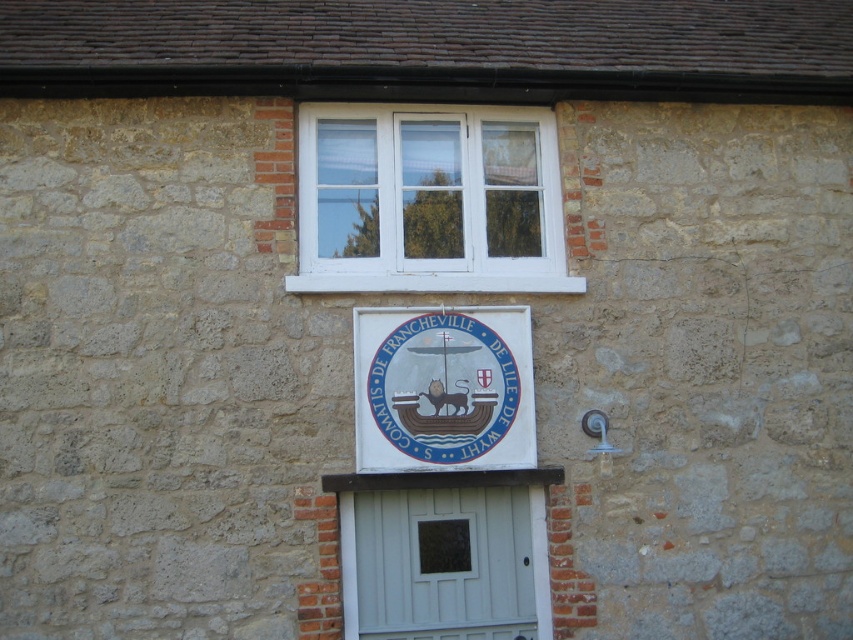
Is white plastic window at upper center taller than white painted wood door at center?

Yes.

Who is more distant from viewer, [457,163] or [387,589]?

The point [457,163] is behind.

Find the location of a particular element. white plastic window at upper center is located at coordinates (428, 200).

Can you confirm if white painted wood door at center is positioned below white glossy sign at center?

Indeed, white painted wood door at center is positioned under white glossy sign at center.

Can you confirm if white painted wood door at center is positioned to the left of white glossy sign at center?

No, white painted wood door at center is not to the left of white glossy sign at center.

Is point (431, 516) positioned in front of point (492, 424)?

No, it is not.

Identify the location of white painted wood door at center. (445, 563).

Who is positioned more to the left, white plastic window at upper center or white glossy sign at center?

white plastic window at upper center

Which is more to the right, white plastic window at upper center or white glossy sign at center?

white glossy sign at center

Locate an element on the screen. Image resolution: width=853 pixels, height=640 pixels. white plastic window at upper center is located at coordinates (428, 200).